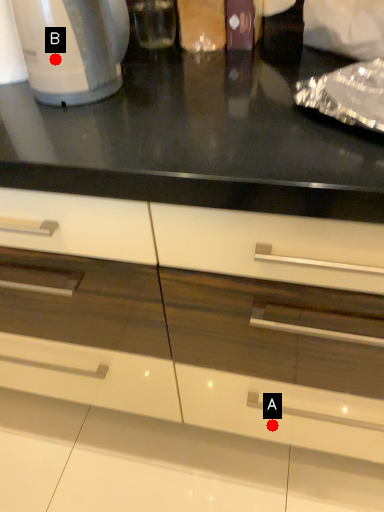
Question: Two points are circled on the image, labeled by A and B beside each circle. Which point appears farthest from the camera in this image?

Choices:
 (A) A is further
 (B) B is further

Answer: (A)